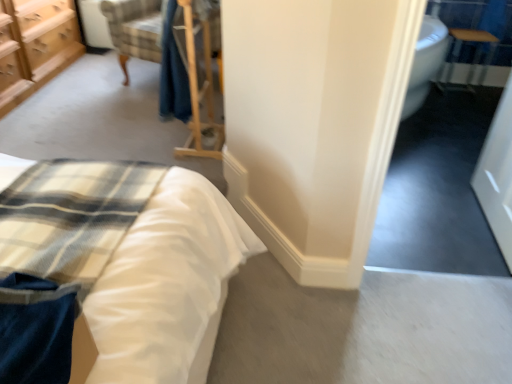
The width and height of the screenshot is (512, 384). I want to click on empty space that is ontop of satin white bed at lower left, so point(65,217).